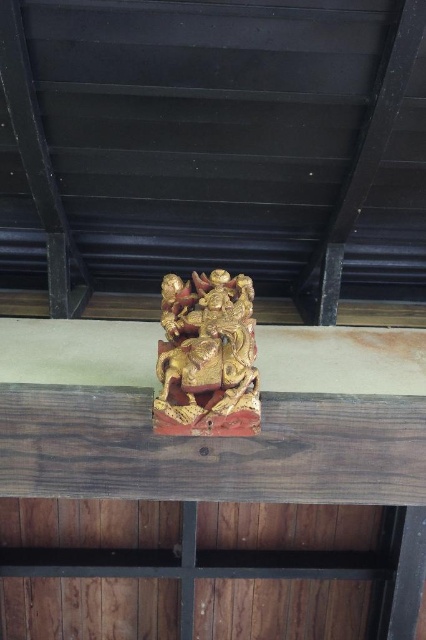
You are an architect planning to install a new decorative element in a traditional building. You have a gold polished wood carving at upper center and a wooden beam at center. Based on the scene, which object is wider?

The wooden beam at center is wider than the gold polished wood carving at upper center according to the description.

You are an architect examining the wooden carving on the beam. You notice two points marked on the carving. The first point is at coordinate (x=356, y=428) and the second is at (x=166, y=348). If you were to touch both points with your finger, which point would feel closer to you?

Point (x=356, y=428) is further to the viewer than point (x=166, y=348), so touching point (x=356, y=428) would feel closer to you.

You are a painter standing 1.5 meters away from the wooden beam at center. You want to paint the carving on the beam. Can you reach the beam with your 1.8 meter long paintbrush?

The wooden beam at center is 1.22 meters away from the viewer. Since your paintbrush is 1.8 meters long, which is longer than the distance to the beam, you can reach it.